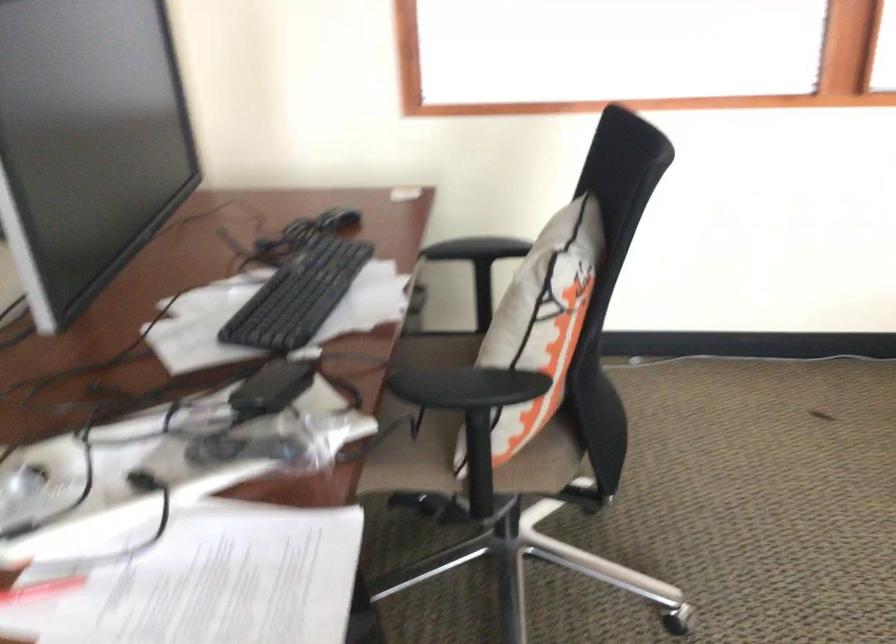
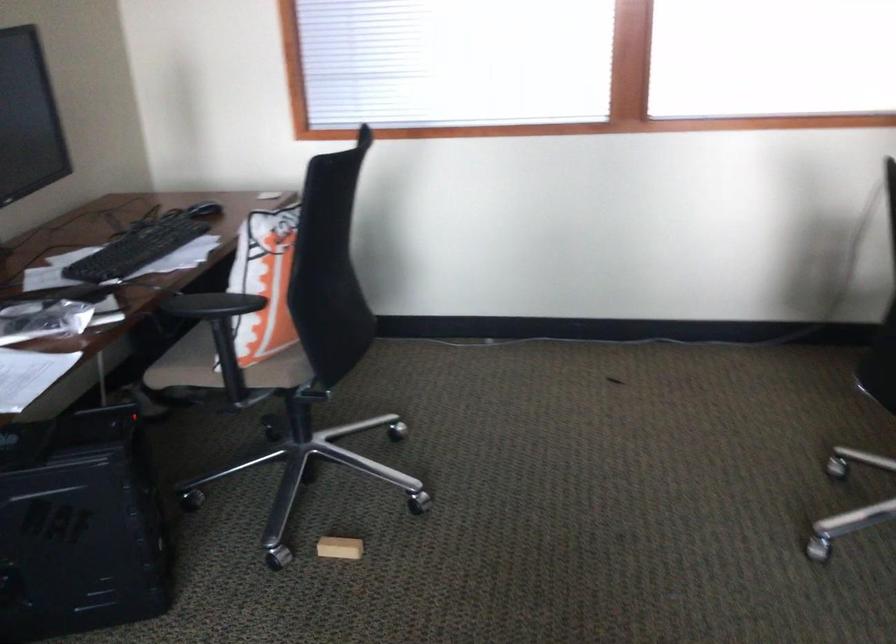
Find the pixel in the second image that matches the point at 478,395 in the first image.

(211, 305)